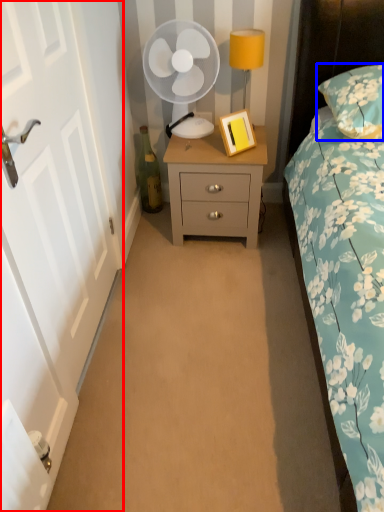
Question: Which object appears farthest to the camera in this image, door (highlighted by a red box) or pillow (highlighted by a blue box)?

Choices:
 (A) door
 (B) pillow

Answer: (B)